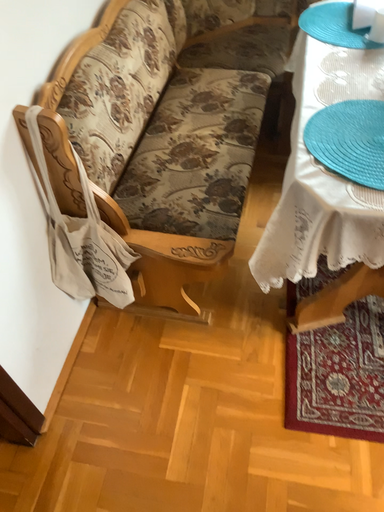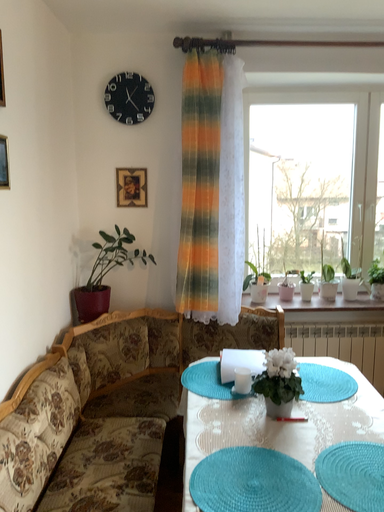
Question: Which way did the camera rotate in the video?

Choices:
 (A) rotated left
 (B) rotated right

Answer: (B)